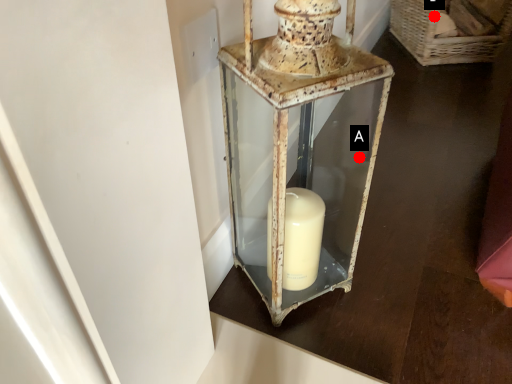
Question: Two points are circled on the image, labeled by A and B beside each circle. Which of the following is the closest to the observer?

Choices:
 (A) A is closer
 (B) B is closer

Answer: (A)